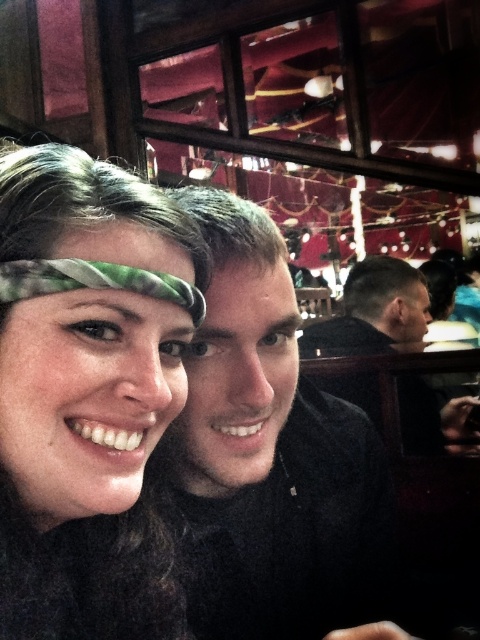
Question: Is matte green headband at center above black matte shirt at center?

Choices:
 (A) yes
 (B) no

Answer: (A)

Question: Which point is farther from the camera taking this photo?

Choices:
 (A) [249, 387]
 (B) [103, 280]

Answer: (A)

Question: Does matte green headband at center have a lesser width compared to black matte shirt at center?

Choices:
 (A) no
 (B) yes

Answer: (B)

Question: Does matte green headband at center have a larger size compared to black matte shirt at center?

Choices:
 (A) no
 (B) yes

Answer: (A)

Question: Which point is closer to the camera taking this photo?

Choices:
 (A) (314, 556)
 (B) (98, 209)

Answer: (B)

Question: Among these objects, which one is farthest from the camera?

Choices:
 (A) black matte shirt at center
 (B) matte green headband at center

Answer: (A)